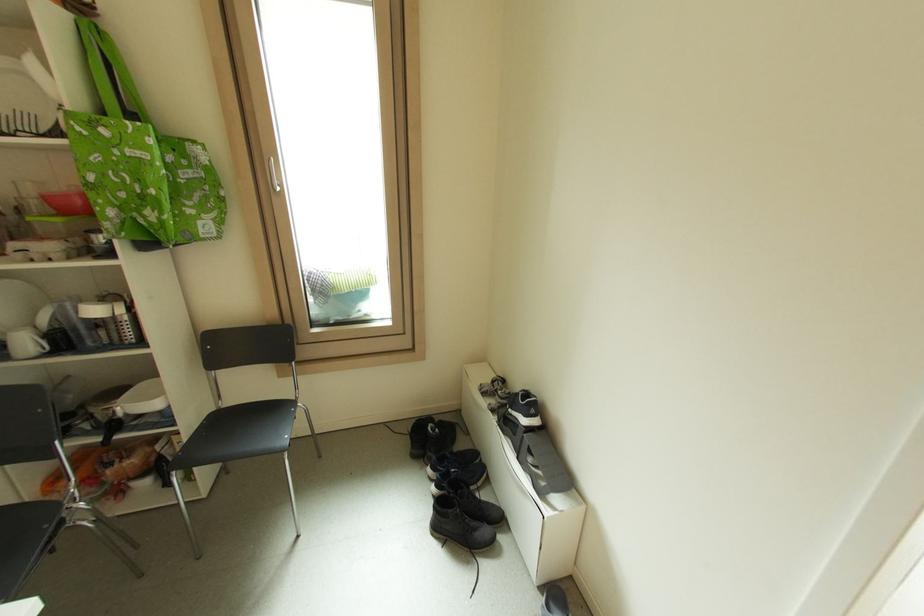
Find where to lift the white mug. Please return your answer as a coordinate pair (x, y).

(25, 342)